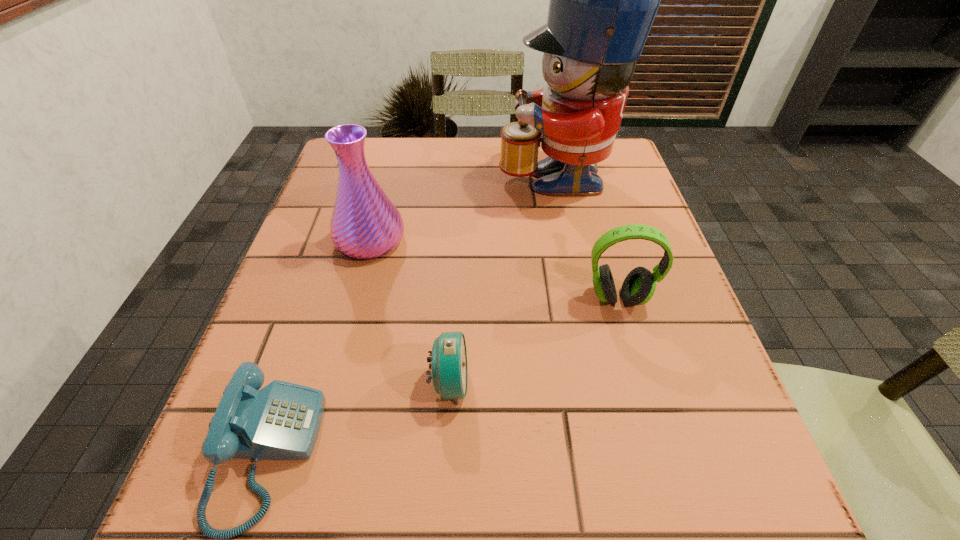
Locate an element on the screen. Image resolution: width=960 pixels, height=540 pixels. the farthest object is located at coordinates (603, 1).

This screenshot has width=960, height=540. What are the coordinates of `nutcracker` in the screenshot? It's located at (603, 1).

Find the location of `vase`. vase is located at coordinates (365, 224).

Locate an element on the screen. This screenshot has width=960, height=540. the fourth shortest object is located at coordinates (365, 224).

The height and width of the screenshot is (540, 960). I want to click on the third shortest object, so click(639, 286).

At what (x,y) coordinates should I click in order to perform the action: click on headset. Please return your answer as a coordinate pair (x, y). The image size is (960, 540). Looking at the image, I should click on (639, 286).

Locate an element on the screen. alarm clock is located at coordinates (449, 364).

At what (x,y) coordinates should I click in order to perform the action: click on the third object from right to left. Please return your answer as a coordinate pair (x, y). Looking at the image, I should click on (449, 364).

Find the location of a particular element. The height and width of the screenshot is (540, 960). free space located on the front-facing side of the tallest object is located at coordinates (396, 173).

You are a GUI agent. You are given a task and a screenshot of the screen. Output one action in this format:
    pyautogui.click(x=<x>, y=<y>)
    Task: Click on the free space located on the front-facing side of the tallest object
    
    Given the screenshot: What is the action you would take?
    pyautogui.click(x=467, y=173)